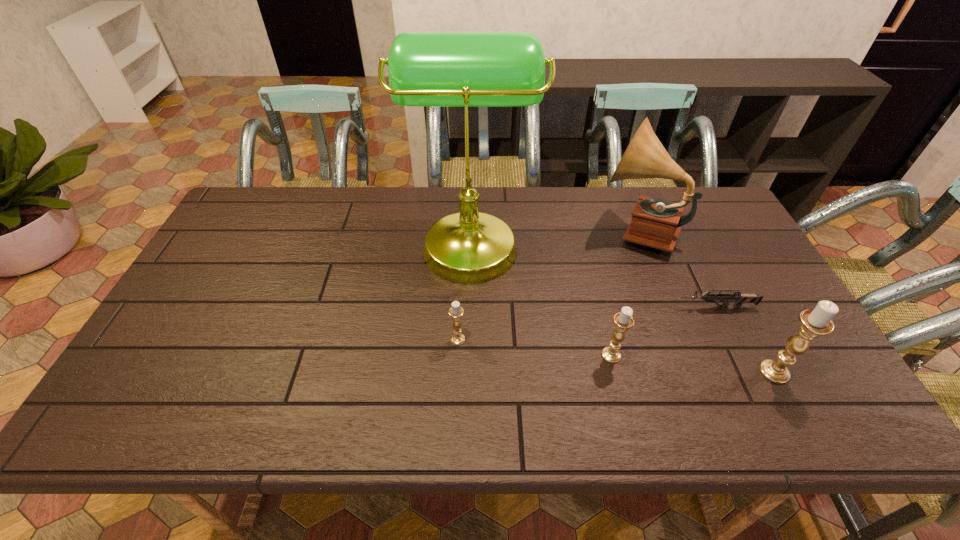
Image resolution: width=960 pixels, height=540 pixels. In order to click on free region at the near right corner in this screenshot , I will do `click(810, 382)`.

Locate an element on the screen. The height and width of the screenshot is (540, 960). free space between the leftmost candle holder and the shortest object is located at coordinates (588, 323).

At what (x,y) coordinates should I click in order to perform the action: click on vacant area that lies between the fourth nearest object and the leftmost candle holder. Please return your answer as a coordinate pair (x, y). Looking at the image, I should click on (588, 323).

Find the location of `empty space that is in between the third object from left to right and the shortest object`. empty space that is in between the third object from left to right and the shortest object is located at coordinates click(x=664, y=331).

Locate an element on the screen. empty location between the lamp and the tallest candle holder is located at coordinates (622, 307).

Locate an element on the screen. vacant point located between the fourth shortest object and the shortest object is located at coordinates (746, 339).

Where is `free space between the second tallest object and the farthest candle holder`? The image size is (960, 540). free space between the second tallest object and the farthest candle holder is located at coordinates click(x=547, y=285).

Image resolution: width=960 pixels, height=540 pixels. Find the location of `empty location between the third object from left to right and the gun`. empty location between the third object from left to right and the gun is located at coordinates (664, 331).

Locate an element on the screen. The image size is (960, 540). unoccupied area between the shortest candle holder and the lamp is located at coordinates [x=464, y=291].

Identify which object is located as the fourth nearest to the phonograph record. Please provide its 2D coordinates. Your answer should be formatted as a tuple, i.e. [(x, y)], where the tuple contains the x and y coordinates of a point satisfying the conditions above.

[(815, 322)]